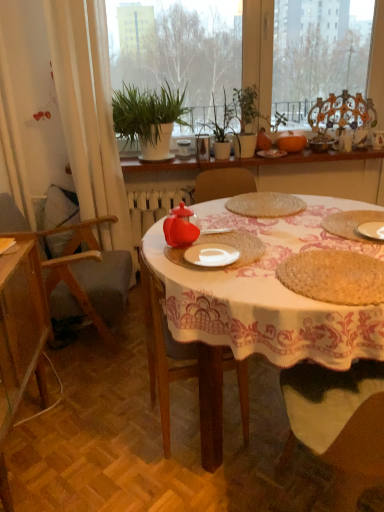
This screenshot has height=512, width=384. What are the coordinates of `vacant area that is in front of white ceramic plate at center` in the screenshot? It's located at (227, 280).